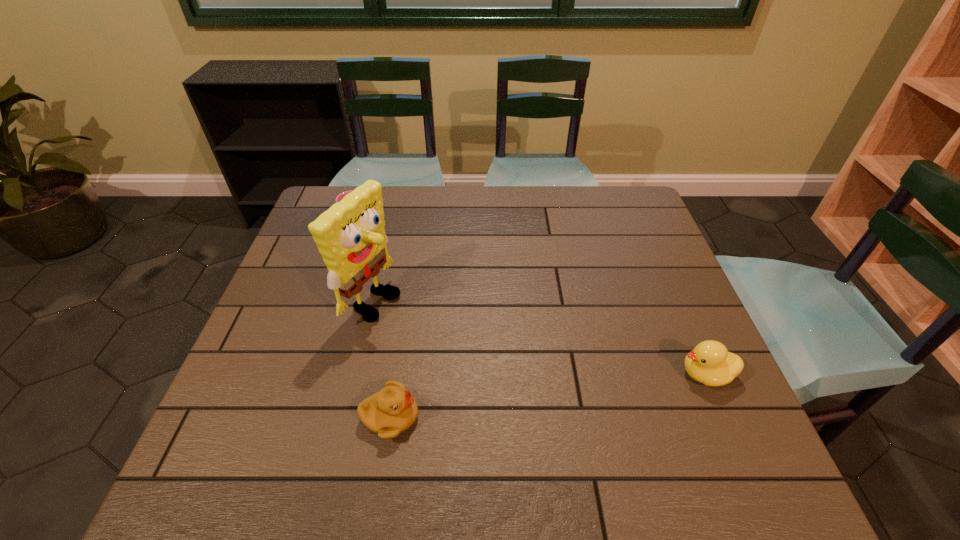
The width and height of the screenshot is (960, 540). In order to click on vacant space on the desktop that is between the left duckling and the right duckling and is positioned on the face of the sponge in this screenshot , I will do `click(583, 391)`.

Find the location of a particular element. The width and height of the screenshot is (960, 540). vacant space on the desktop that is between the left duckling and the rightmost object and is positioned on the side with the handle of the farthest object is located at coordinates pyautogui.click(x=516, y=400).